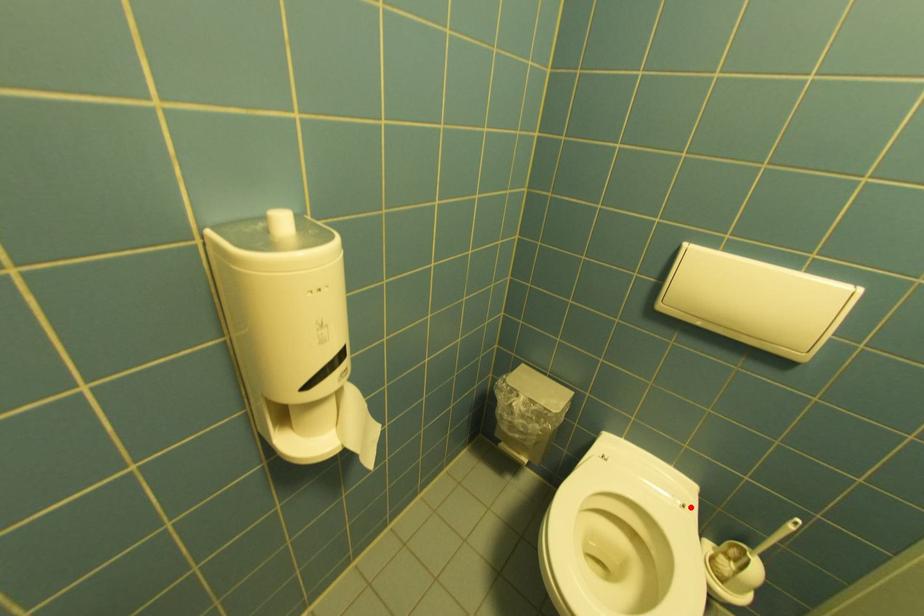
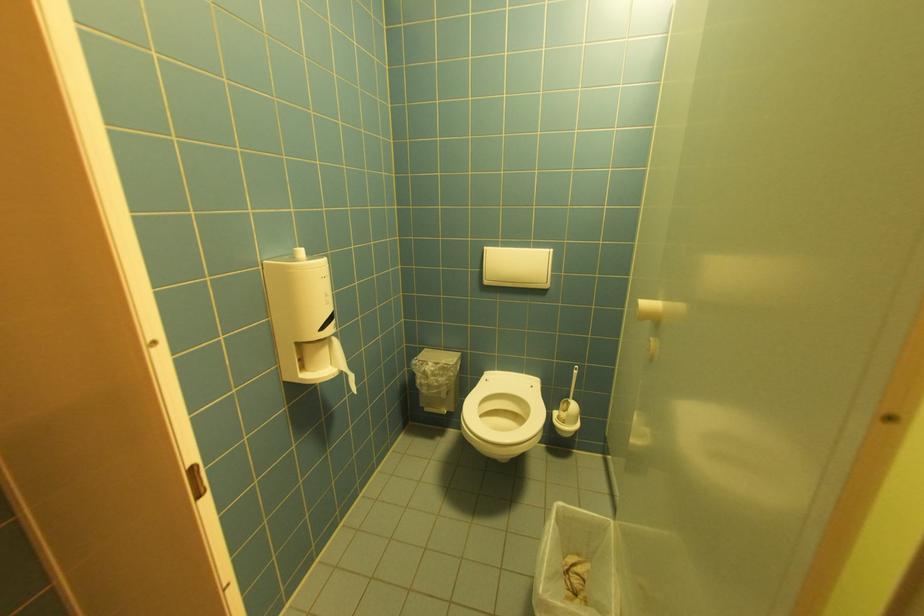
The point at the highlighted location is marked in the first image. Where is the corresponding point in the second image?

(538, 387)